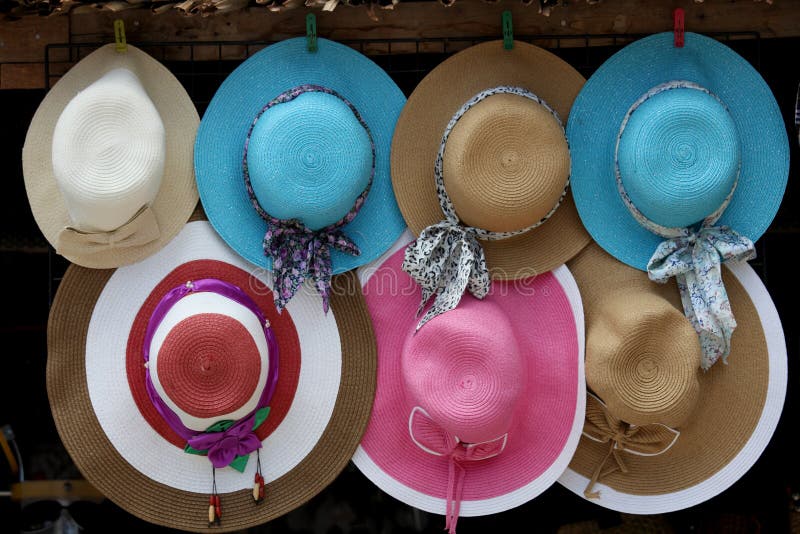
This screenshot has width=800, height=534. I want to click on grate, so (229, 45).